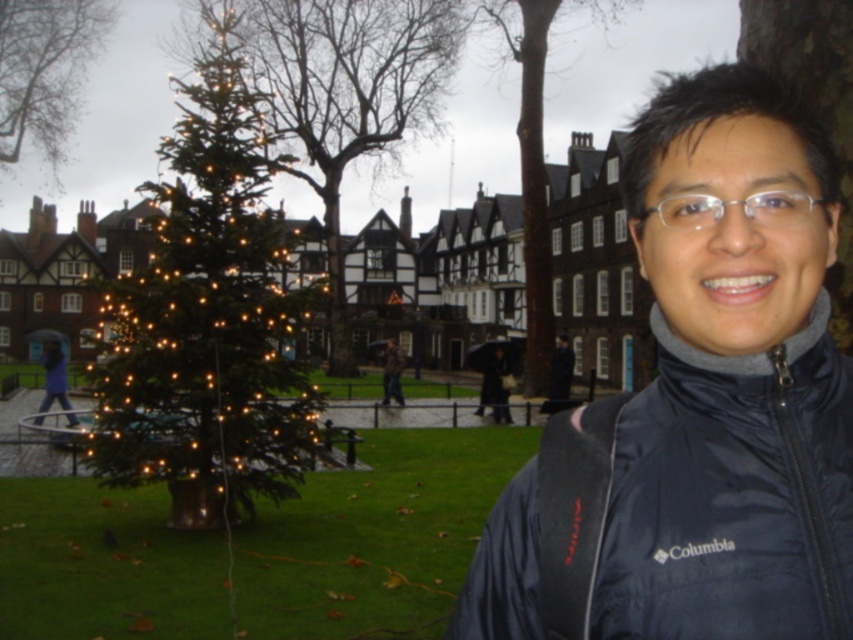
Is point (242, 200) behind point (770, 28)?

Yes.

Between green matte christmas tree at left and green matte christmas tree at center, which one has more height?

green matte christmas tree at left

Locate an element on the screen. The image size is (853, 640). green matte christmas tree at left is located at coordinates (207, 317).

Image resolution: width=853 pixels, height=640 pixels. I want to click on green matte christmas tree at left, so click(207, 317).

Can you confirm if green textured christmas tree at left is smaller than dark blue jacket at lower left?

Actually, green textured christmas tree at left might be larger than dark blue jacket at lower left.

Can you confirm if green textured christmas tree at left is positioned above dark blue jacket at lower left?

Correct, green textured christmas tree at left is located above dark blue jacket at lower left.

In order to click on green textured christmas tree at left in this screenshot , I will do `click(343, 96)`.

Does green matte christmas tree at center have a larger size compared to clear plastic glasses at center?

Indeed, green matte christmas tree at center has a larger size compared to clear plastic glasses at center.

Is green matte christmas tree at center shorter than clear plastic glasses at center?

Incorrect, green matte christmas tree at center's height does not fall short of clear plastic glasses at center's.

Which is in front, point (763, 36) or point (761, 211)?

Point (761, 211) is in front.

Locate an element on the screen. green matte christmas tree at center is located at coordinates (813, 100).